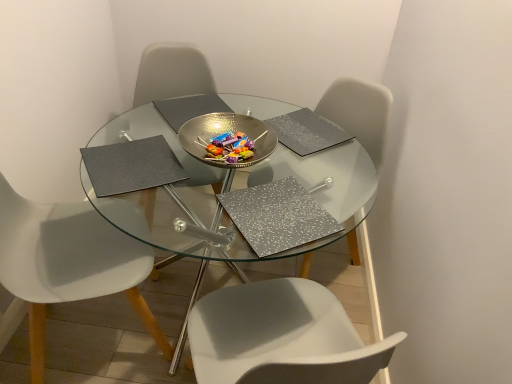
This screenshot has height=384, width=512. What are the coordinates of `empty space that is ontop of silver textured pad at center, the 2th pad when ordered from right to left (from a real-world perspective)` in the screenshot? It's located at (266, 212).